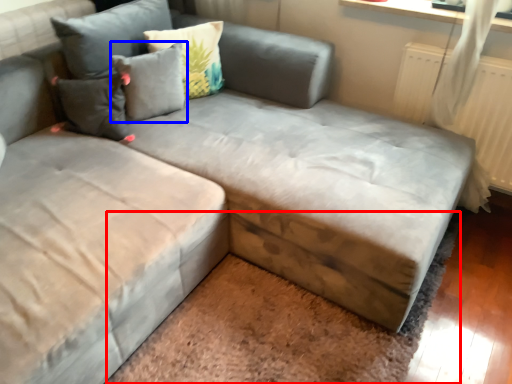
Question: Which object appears closest to the camera in this image, mat (highlighted by a red box) or pillow (highlighted by a blue box)?

Choices:
 (A) mat
 (B) pillow

Answer: (A)